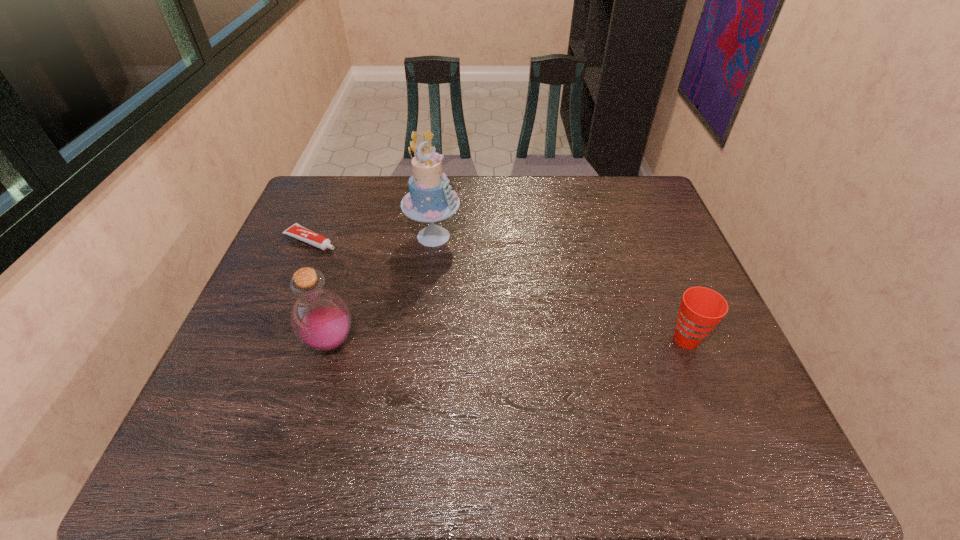
Identify the location of bottle. Image resolution: width=960 pixels, height=540 pixels. click(x=320, y=318).

Identify the location of the rightmost object. The width and height of the screenshot is (960, 540). [x=701, y=309].

At what (x,y) coordinates should I click in order to perform the action: click on the second shortest object. Please return your answer as a coordinate pair (x, y). This screenshot has width=960, height=540. Looking at the image, I should click on (701, 309).

The width and height of the screenshot is (960, 540). I want to click on cake, so click(x=430, y=199).

This screenshot has height=540, width=960. I want to click on the tallest object, so click(430, 199).

Identify the location of the shortest object. (297, 231).

Image resolution: width=960 pixels, height=540 pixels. Find the location of `free spot located 0.050m on the front of the bottle`. free spot located 0.050m on the front of the bottle is located at coordinates (318, 384).

Locate an element on the screen. This screenshot has width=960, height=540. blank space located 0.120m on the front of the second shortest object is located at coordinates (711, 403).

Locate an element on the screen. This screenshot has width=960, height=540. blank area located with a ladder on the side of the tallest object is located at coordinates (468, 271).

Identify the location of vacant space located 0.230m with a ladder on the side of the tallest object. This screenshot has width=960, height=540. (495, 300).